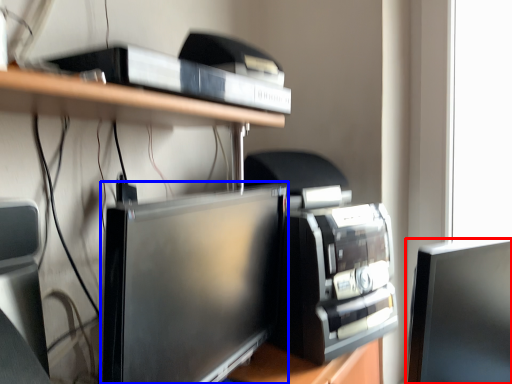
Question: Which object is closer to the camera taking this photo, computer monitor (highlighted by a red box) or computer monitor (highlighted by a blue box)?

Choices:
 (A) computer monitor
 (B) computer monitor

Answer: (B)